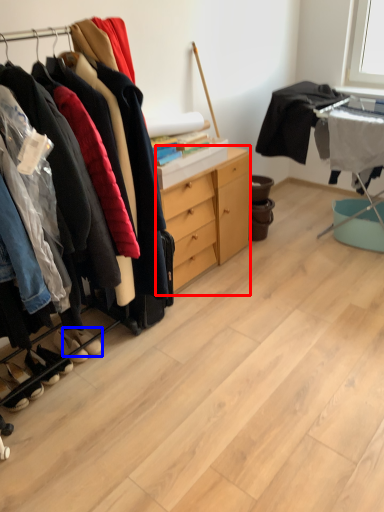
Question: Which of the following is the farthest to the observer, cabinetry (highlighted by a red box) or footwear (highlighted by a blue box)?

Choices:
 (A) cabinetry
 (B) footwear

Answer: (A)